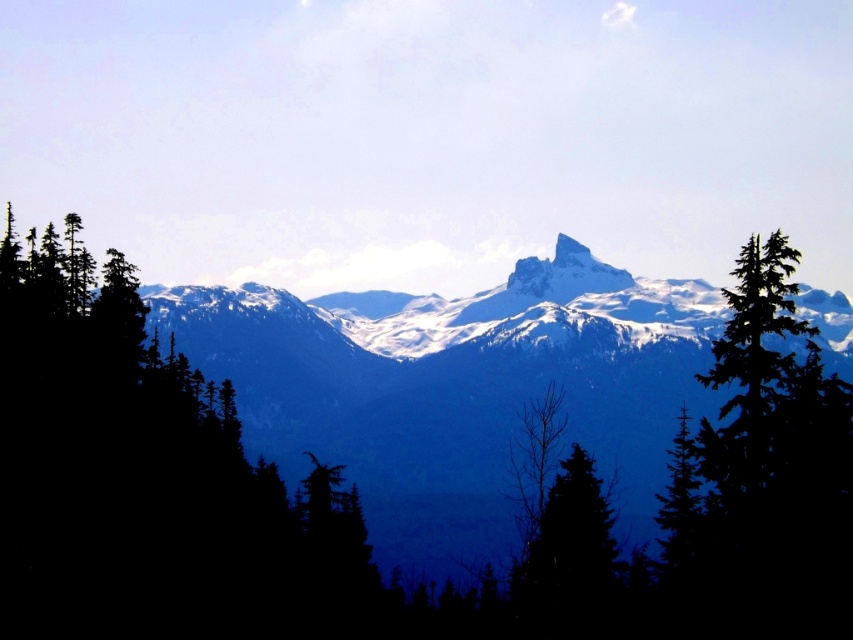
Question: Observing the image, what is the correct spatial positioning of green matte tree at center in reference to white snow-covered peak at center?

Choices:
 (A) left
 (B) right

Answer: (A)

Question: Which object appears farthest from the camera in this image?

Choices:
 (A) green matte tree at lower center
 (B) green matte tree at right
 (C) white snow-covered peak at center

Answer: (C)

Question: Which object appears closest to the camera in this image?

Choices:
 (A) white snow-covered peak at center
 (B) green matte tree at lower center
 (C) green matte tree at center

Answer: (C)

Question: Does green matte tree at right appear under green matte tree at lower center?

Choices:
 (A) yes
 (B) no

Answer: (B)

Question: Estimate the real-world distances between objects in this image. Which object is farther from the white snow-covered peak at center?

Choices:
 (A) green matte tree at center
 (B) green matte tree at right
 (C) green matte tree at lower center

Answer: (B)

Question: Can you confirm if green matte tree at center is positioned above green matte tree at right?

Choices:
 (A) yes
 (B) no

Answer: (B)